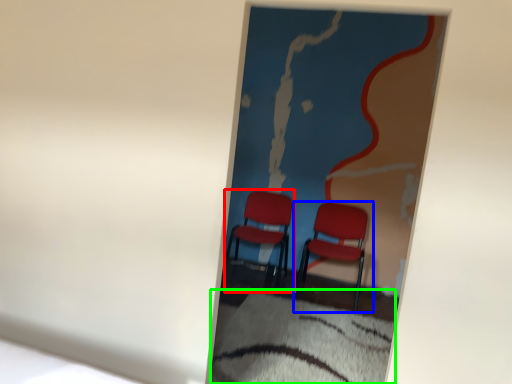
Question: Which object is positioned farthest from chair (highlighted by a red box)? Select from chair (highlighted by a blue box) and sheet (highlighted by a green box).

Choices:
 (A) chair
 (B) sheet

Answer: (B)